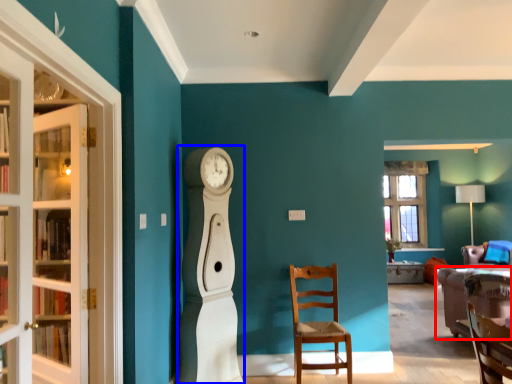
Question: Which point is closer to the camera, studio couch (highlighted by a red box) or open (highlighted by a blue box)?

Choices:
 (A) studio couch
 (B) open

Answer: (B)